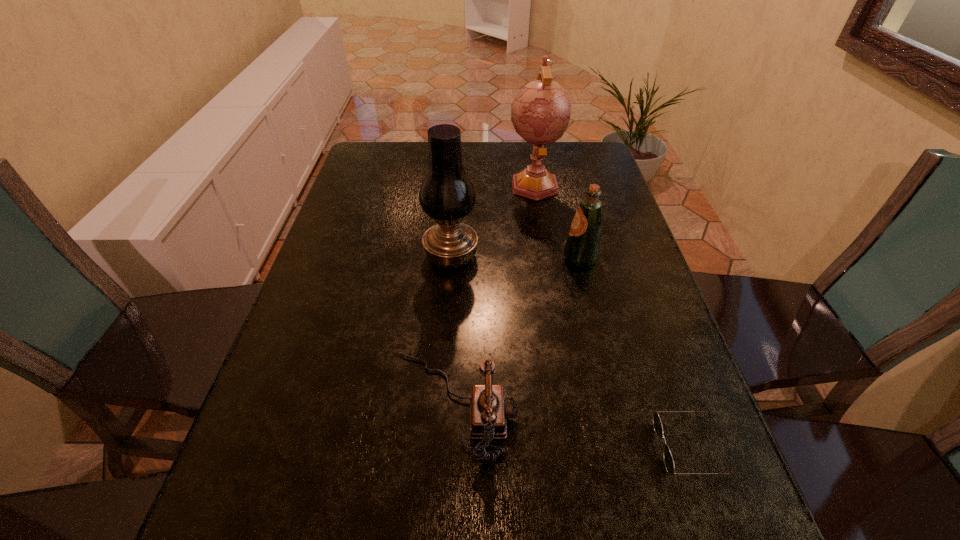
Identify the location of vacant region located on the front-facing side of the olive oil. (520, 258).

At what (x,y) coordinates should I click in order to perform the action: click on blank space located on the dial of the fourth tallest object. Please return your answer as a coordinate pair (x, y). This screenshot has height=540, width=960. Looking at the image, I should click on (x=560, y=405).

Locate an element on the screen. The image size is (960, 540). free point located 0.400m on the front-facing side of the rightmost object is located at coordinates (430, 448).

This screenshot has height=540, width=960. I want to click on free location located 0.200m on the front-facing side of the rightmost object, so click(x=544, y=448).

This screenshot has height=540, width=960. What are the coordinates of `free spot located 0.260m on the front-facing side of the rightmost object` in the screenshot? It's located at (511, 448).

You are a GUI agent. You are given a task and a screenshot of the screen. Output one action in this format:
    pyautogui.click(x=<x>, y=<y>)
    Task: Click on the object present at the far edge
    
    Given the screenshot: What is the action you would take?
    pyautogui.click(x=540, y=112)

This screenshot has height=540, width=960. What are the coordinates of `olive oil that is at the right edge` in the screenshot? It's located at (x=582, y=248).

This screenshot has height=540, width=960. Find the location of `sunglasses present at the right edge`. sunglasses present at the right edge is located at coordinates (657, 425).

Locate an element on the screen. Image resolution: width=960 pixels, height=540 pixels. vacant area at the far edge of the desktop is located at coordinates 506,177.

Find the location of a particular element. This screenshot has width=960, height=540. free space at the left edge of the desktop is located at coordinates (367, 246).